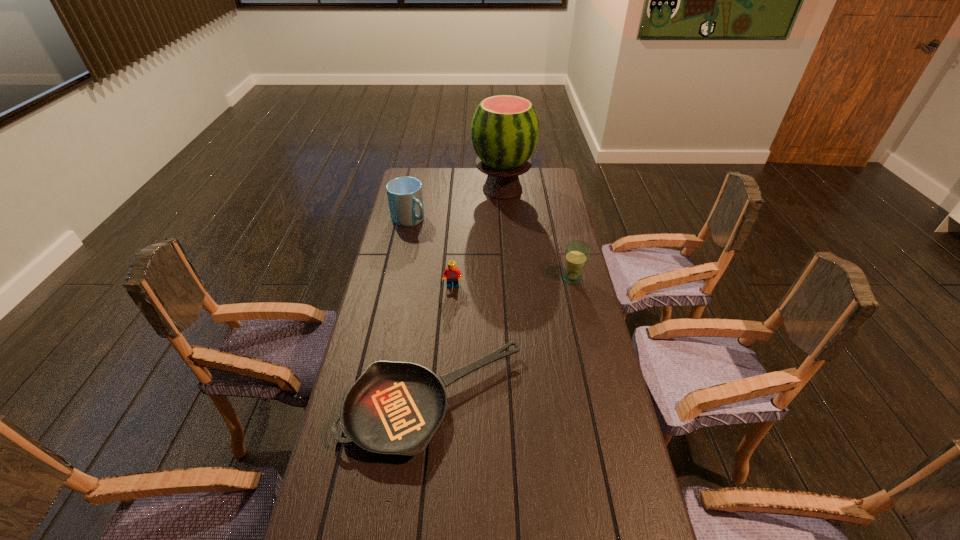
You are a GUI agent. You are given a task and a screenshot of the screen. Output one action in this format:
    pyautogui.click(x=<x>, y=<y>)
    Task: Click on the vacant area situated 0.100m on the face of the Lego
    This screenshot has height=540, width=960.
    Given the screenshot: What is the action you would take?
    pyautogui.click(x=451, y=310)

Locate an element on the screen. Image resolution: width=960 pixels, height=540 pixels. free space located on the front of the frying pan is located at coordinates (425, 493).

Where is `object that is at the far edge`? This screenshot has height=540, width=960. object that is at the far edge is located at coordinates (505, 129).

I want to click on mug located at the left edge, so click(405, 197).

This screenshot has width=960, height=540. Find the location of `frying pan that is positioned at the left edge`. frying pan that is positioned at the left edge is located at coordinates (394, 408).

Where is `watermelon that is at the right edge`? The image size is (960, 540). watermelon that is at the right edge is located at coordinates (505, 129).

What are the coordinates of `glass present at the right edge` in the screenshot? It's located at (577, 252).

The width and height of the screenshot is (960, 540). I want to click on object situated at the far right corner, so click(505, 129).

Locate an element on the screen. The width and height of the screenshot is (960, 540). vacant area at the left edge is located at coordinates (310, 527).

Where is `free region at the right edge of the desktop`? The width and height of the screenshot is (960, 540). free region at the right edge of the desktop is located at coordinates (558, 235).